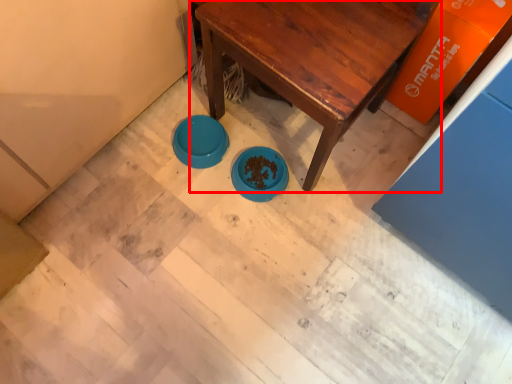
Question: Considering the relative positions of table (annotated by the red box) and basin in the image provided, where is table (annotated by the red box) located with respect to the staircase?

Choices:
 (A) left
 (B) right

Answer: (B)